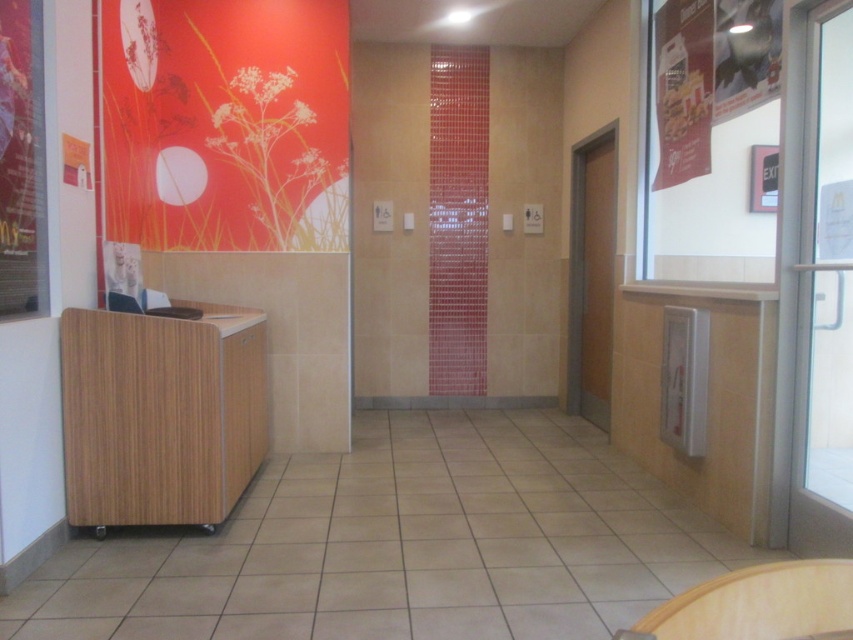
Question: Considering the relative positions of wooden chair at lower right and wooden chair at left in the image provided, where is wooden chair at lower right located with respect to wooden chair at left?

Choices:
 (A) right
 (B) left

Answer: (A)

Question: Is matte red poster at upper left in front of wooden chair at left?

Choices:
 (A) no
 (B) yes

Answer: (B)

Question: Which of the following is the farthest from the observer?

Choices:
 (A) (111, 106)
 (B) (712, 28)
 (C) (741, 17)
 (D) (18, 68)

Answer: (B)

Question: Which point is closer to the camera?

Choices:
 (A) matte paper poster at left
 (B) matte paper poster at upper right
 (C) matte red poster at upper left

Answer: (A)

Question: Which of the following is the farthest from the observer?

Choices:
 (A) matte paper poster at left
 (B) matte paper poster at upper right

Answer: (B)

Question: Is wooden chair at lower right to the right of metallic gold poster at upper right from the viewer's perspective?

Choices:
 (A) no
 (B) yes

Answer: (A)